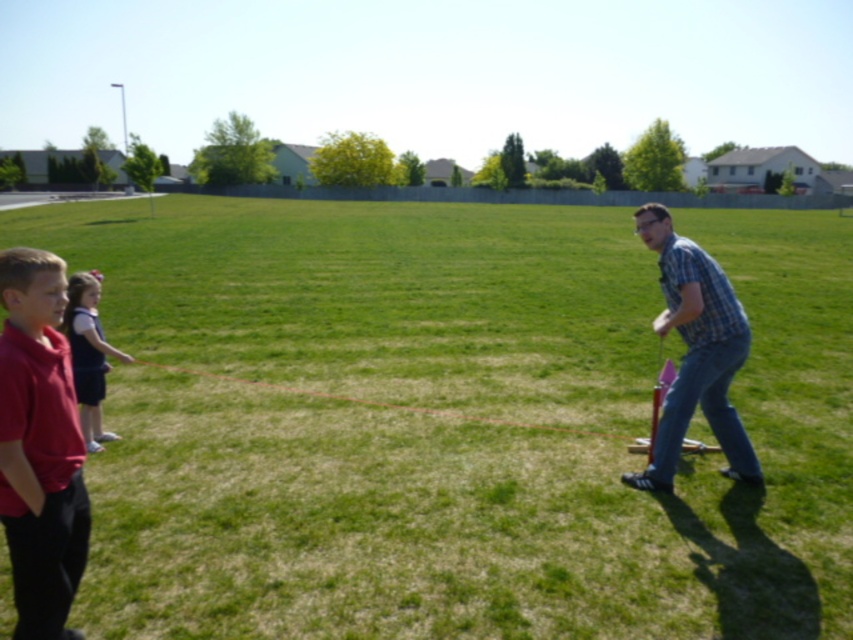
Can you confirm if plaid shirt at right is thinner than red string at center?

Incorrect, plaid shirt at right's width is not less than red string at center's.

Who is higher up, plaid shirt at right or red string at center?

plaid shirt at right is higher up.

Which is behind, point (724, 380) or point (654, 424)?

Positioned behind is point (654, 424).

The height and width of the screenshot is (640, 853). I want to click on plaid shirt at right, so click(x=695, y=353).

Is point (701, 369) in front of point (111, 349)?

Yes.

Does plaid shirt at right appear over dark blue dress at left?

Indeed, plaid shirt at right is positioned over dark blue dress at left.

Is point (631, 472) more distant than point (94, 401)?

No, (631, 472) is closer to viewer.

Identify the location of plaid shirt at right. (695, 353).

Is green grassy field at center above dark blue dress at left?

Yes, green grassy field at center is above dark blue dress at left.

Is green grassy field at center thinner than dark blue dress at left?

In fact, green grassy field at center might be wider than dark blue dress at left.

This screenshot has width=853, height=640. I want to click on green grassy field at center, so click(490, 497).

Locate an element on the screen. green grassy field at center is located at coordinates (490, 497).